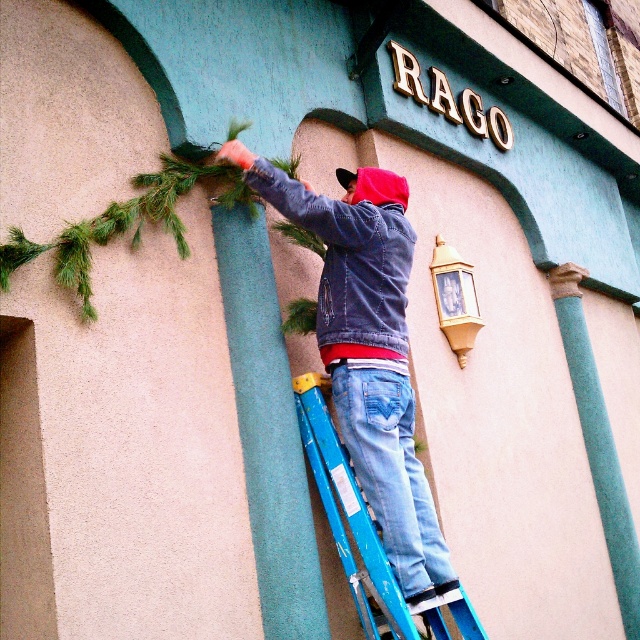
You are a painter who needs to place a 3ft wide painting on the wall. You see the denim jacket at center and the blue metallic ladder at center. Which object is wider so that the painting can be placed next to it?

The denim jacket at center is wider than the blue metallic ladder at center. Since the painting is 3ft wide, placing it next to the denim jacket at center would be appropriate as it has sufficient width.

You are a painter who needs to climb the blue metallic ladder at center to reach a high wall. However, the denim jacket at center is blocking your path. Can you move the ladder to the side to access it?

The blue metallic ladder at center is behind the denim jacket at center, so you can move the ladder to the side to access it by moving the denim jacket out of the way first.

You are a painter who needs to reach the top of the blue metallic ladder at center to paint the gold letters above. Your paint bucket is on the denim jacket at center. Can you safely carry the paint bucket up the ladder without spilling?

The denim jacket at center and blue metallic ladder at center are 35.81 centimeters apart. Since the distance between them is relatively short, you can safely carry the paint bucket from the denim jacket at center to the blue metallic ladder at center without spilling.